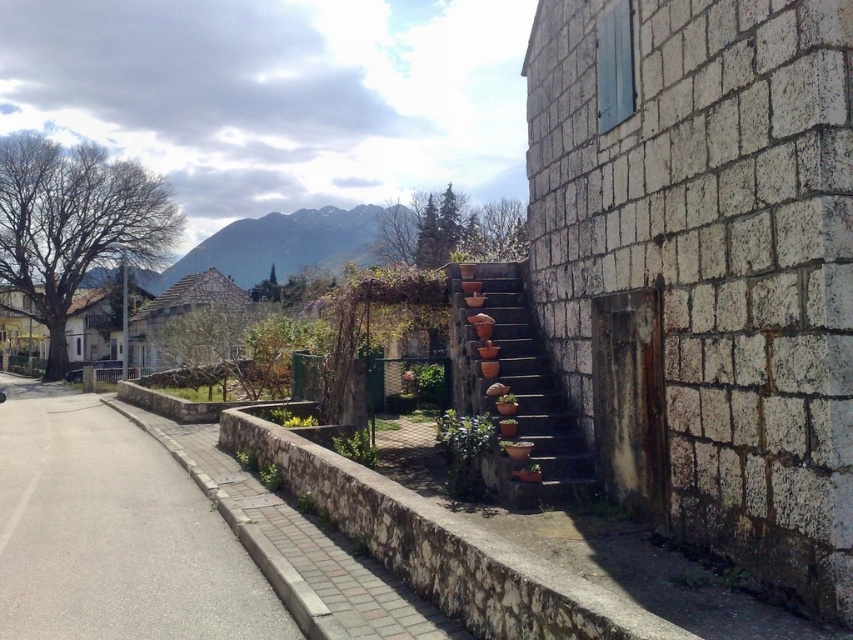
Based on the photo, you are a painter who wants to paint both the white stone wall at right and the gray asphalt pavement at lower left. Which surface has a smaller width?

The white stone wall at right has a smaller width than the gray asphalt pavement at lower left.

You are standing at the base of the stone staircase leading to the building. You want to walk to the gray asphalt pavement at lower left. Which direction should you head?

You should head to the left direction to reach the gray asphalt pavement at lower left since it is located at point [113,532] which is to the left side of the scene.

You are a gardener standing at the base of the stone staircase. You need to move a heavy wheelbarrow from the garden to the road. Which direction should you push the wheelbarrow to reach the gray asphalt pavement at lower left from the terracotta clay pots at center?

You should push the wheelbarrow to the left, as the gray asphalt pavement at lower left is located to the left of the terracotta clay pots at center.